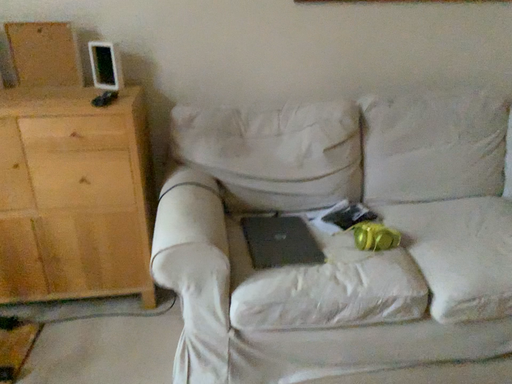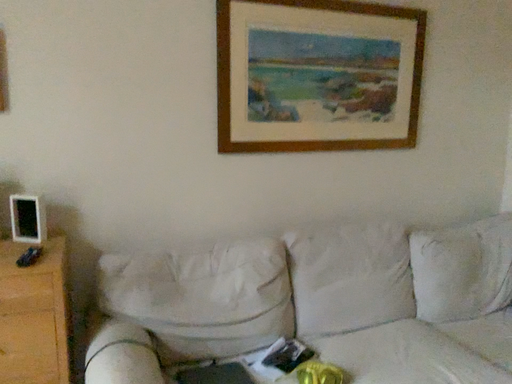
Question: Which way did the camera rotate in the video?

Choices:
 (A) rotated downward
 (B) rotated upward

Answer: (B)